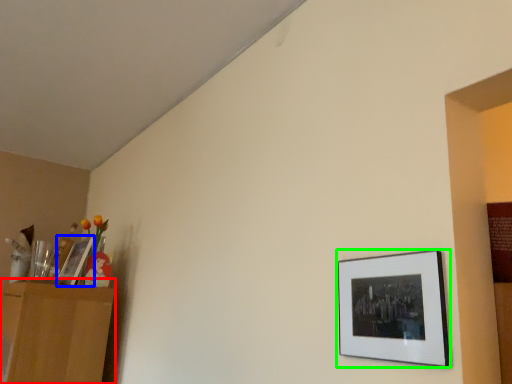
Question: Which object is the farthest from dresser (highlighted by a red box)? Choose among these: picture frame (highlighted by a blue box) or picture frame (highlighted by a green box).

Choices:
 (A) picture frame
 (B) picture frame

Answer: (B)